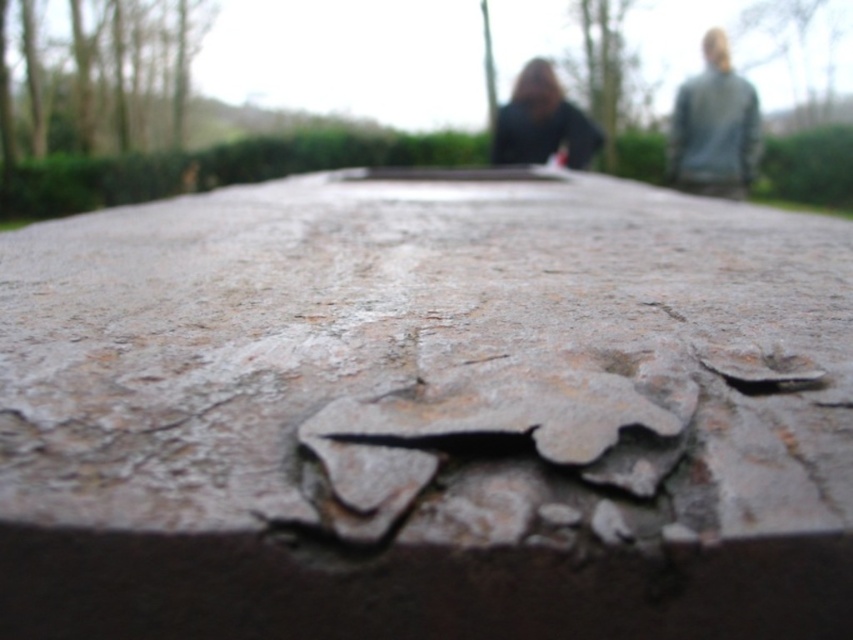
You are a photographer adjusting your camera focus. You notice the gray matte jacket at upper right and the matte black hair at upper center in your viewfinder. Which object should you focus on first if you want to ensure the closest subject is sharp?

The gray matte jacket at upper right is closer to the viewer than the matte black hair at upper center, so you should focus on the gray matte jacket at upper right first to ensure the closest subject is sharp.

Looking at this image, you are trying to identify the person in the foreground of the image. The scene shows a close view of a weathered stone surface with two people in the background. You notice two distinct hair features labeled as blurred hair at upper center and matte black hair at upper center. Which hair feature is closer to the camera?

The blurred hair at upper center is closer to the camera because the matte black hair at upper center is behind it, as indicated by their relative positions.